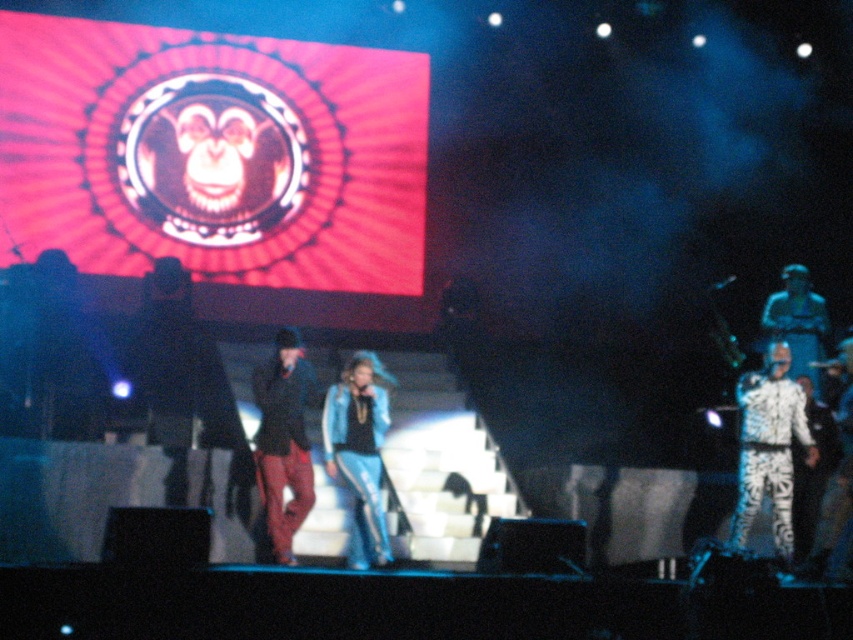
Question: Is white zebra-patterned suit at right further to camera compared to blue denim jacket at center?

Choices:
 (A) yes
 (B) no

Answer: (B)

Question: Which point is farther from the camera taking this photo?

Choices:
 (A) (292, 488)
 (B) (799, 422)
 (C) (380, 500)
 (D) (790, 301)

Answer: (D)

Question: Where is blue denim jacket at center located in relation to white printed pants at right in the image?

Choices:
 (A) right
 (B) left

Answer: (B)

Question: Can you confirm if white zebra-patterned suit at right is thinner than matte black jacket at center?

Choices:
 (A) no
 (B) yes

Answer: (A)

Question: Among these objects, which one is farthest from the camera?

Choices:
 (A) matte black jacket at center
 (B) white printed pants at right

Answer: (B)

Question: Estimate the real-world distances between objects in this image. Which object is closer to the white zebra-patterned suit at right?

Choices:
 (A) white printed pants at right
 (B) matte black jacket at center
 (C) blue denim jacket at center

Answer: (A)